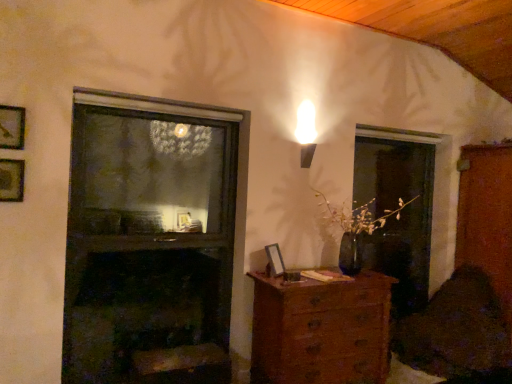
Question: From a real-world perspective, relative to velvet dark brown swivel chair at lower right, is wooden picture frame at upper left, the third picture frame in the right-to-left sequence, vertically above or below?

Choices:
 (A) below
 (B) above

Answer: (B)

Question: Is wooden picture frame at upper left, which is the 2th picture frame in back-to-front order, bigger or smaller than velvet dark brown swivel chair at lower right?

Choices:
 (A) small
 (B) big

Answer: (A)

Question: Which object is the closest to the dark glass fireplace at center?

Choices:
 (A) velvet dark brown swivel chair at lower right
 (B) wooden chest of drawers at lower center
 (C) transparent glass screen door at right
 (D) wooden picture frame at upper left, the first picture frame when ordered from left to right
 (E) wooden picture frame at upper left, which is the 1th picture frame from top to bottom

Answer: (B)

Question: Which of these objects is positioned farthest from the wooden picture frame at lower center, positioned as the third picture frame in left-to-right order?

Choices:
 (A) wooden picture frame at upper left, positioned as the 3th picture frame in bottom-to-top order
 (B) wooden file cabinet at right
 (C) wooden chest of drawers at lower center
 (D) wooden picture frame at upper left, which is the 2th picture frame in back-to-front order
 (E) dark glass fireplace at center

Answer: (B)